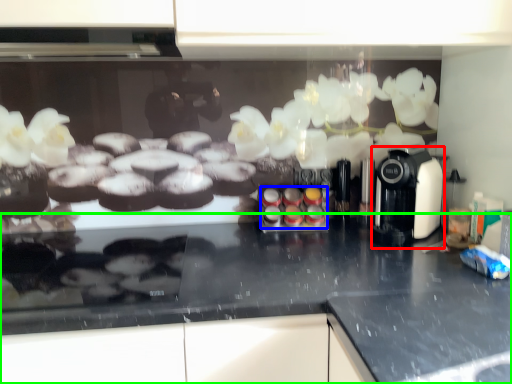
Question: Considering the real-world distances, which object is closest to coffee machine (highlighted by a red box)? food (highlighted by a blue box) or countertop (highlighted by a green box).

Choices:
 (A) food
 (B) countertop

Answer: (A)